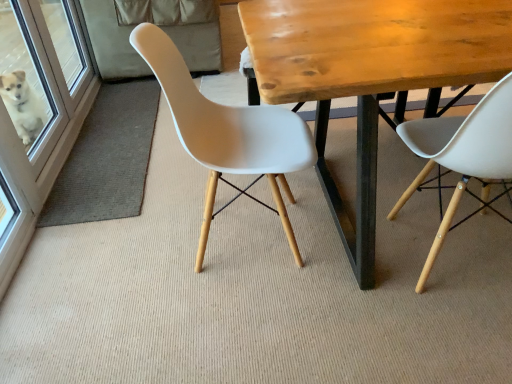
Question: Does white plastic chair at right, which is the 1th chair in right-to-left order, have a lesser height compared to wooden table at center?

Choices:
 (A) no
 (B) yes

Answer: (A)

Question: From a real-world perspective, is white plastic chair at right, the second chair in the left-to-right sequence, below wooden table at center?

Choices:
 (A) yes
 (B) no

Answer: (B)

Question: From the image's perspective, does white plastic chair at right, the second chair in the left-to-right sequence, appear lower than wooden table at center?

Choices:
 (A) yes
 (B) no

Answer: (A)

Question: Can we say white plastic chair at right, the second chair in the left-to-right sequence, lies outside wooden table at center?

Choices:
 (A) yes
 (B) no

Answer: (B)

Question: Is white plastic chair at right, which is the 1th chair in right-to-left order, in contact with wooden table at center?

Choices:
 (A) no
 (B) yes

Answer: (A)

Question: From a real-world perspective, is white plastic chair at right, which is the 1th chair in right-to-left order, over wooden table at center?

Choices:
 (A) yes
 (B) no

Answer: (A)

Question: Is white plastic chair at center, the second chair viewed from the right, a part of white plastic chair at right, which is the 1th chair in right-to-left order?

Choices:
 (A) no
 (B) yes

Answer: (A)

Question: Does white plastic chair at right, the second chair in the left-to-right sequence, have a greater height compared to white plastic chair at center, the second chair viewed from the right?

Choices:
 (A) yes
 (B) no

Answer: (A)

Question: Is white plastic chair at right, which is the 1th chair in right-to-left order, closer to the viewer compared to white plastic chair at center, the 1th chair positioned from the left?

Choices:
 (A) yes
 (B) no

Answer: (A)

Question: From a real-world perspective, is white plastic chair at right, the second chair in the left-to-right sequence, located beneath white plastic chair at center, the 1th chair positioned from the left?

Choices:
 (A) no
 (B) yes

Answer: (A)

Question: Is white plastic chair at right, the second chair in the left-to-right sequence, facing away from white plastic chair at center, the second chair viewed from the right?

Choices:
 (A) yes
 (B) no

Answer: (B)

Question: Is white plastic chair at right, the second chair in the left-to-right sequence, smaller than white plastic chair at center, the second chair viewed from the right?

Choices:
 (A) no
 (B) yes

Answer: (B)

Question: Considering the relative sizes of white plastic chair at center, the 1th chair positioned from the left, and white glossy screen door at left in the image provided, is white plastic chair at center, the 1th chair positioned from the left, taller than white glossy screen door at left?

Choices:
 (A) yes
 (B) no

Answer: (A)